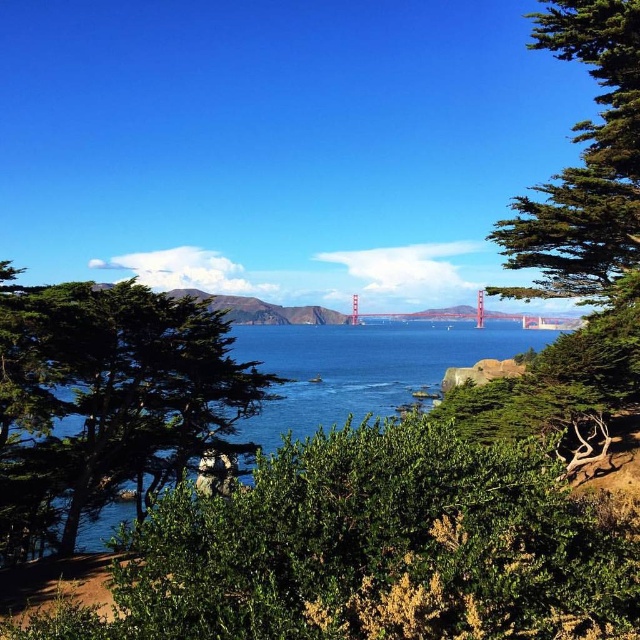
Is point (560, 332) closer to camera compared to point (440, 320)?

Yes, point (560, 332) is in front of point (440, 320).

In the scene shown: Does blue liquid water at center have a lesser height compared to metallic bridge at center?

Indeed, blue liquid water at center has a lesser height compared to metallic bridge at center.

Is point (252, 422) less distant than point (481, 296)?

Yes, point (252, 422) is in front of point (481, 296).

Identify the location of blue liquid water at center. This screenshot has width=640, height=640. (362, 369).

Between green textured tree at right and blue liquid water at center, which one has less height?

blue liquid water at center

What are the coordinates of `green textured tree at right` in the screenshot? It's located at (584, 164).

Is green leafy tree at center bigger than blue liquid water at center?

No, green leafy tree at center is not bigger than blue liquid water at center.

Which is more to the left, green leafy tree at center or blue liquid water at center?

green leafy tree at center is more to the left.

Is point (70, 532) less distant than point (413, 385)?

Yes, point (70, 532) is closer to viewer.

You are a GUI agent. You are given a task and a screenshot of the screen. Output one action in this format:
    pyautogui.click(x=<x>, y=<y>)
    Task: Click on the green leafy tree at center
    
    Given the screenshot: What is the action you would take?
    pyautogui.click(x=106, y=396)